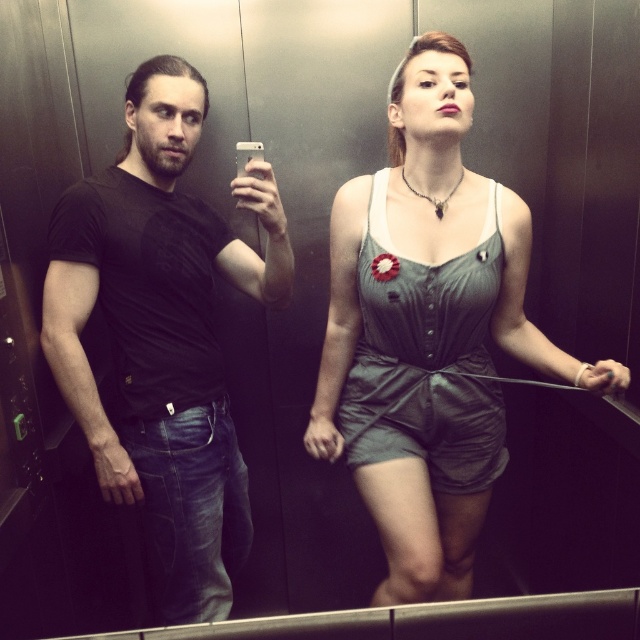
Is black matte t-shirt at center wider than matte green romper at center?

No.

Which is more to the right, black matte t-shirt at center or matte green romper at center?

matte green romper at center

Find the location of a particular element. This screenshot has height=640, width=640. black matte t-shirt at center is located at coordinates (163, 336).